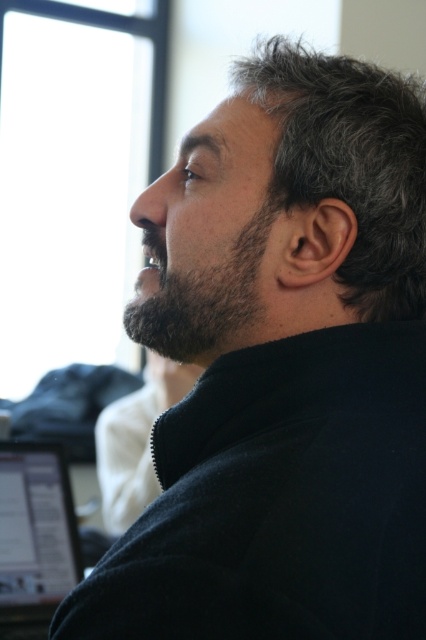
Question: Which object is farther from the camera taking this photo?

Choices:
 (A) black glossy laptop at lower left
 (B) dark brown fuzzy beard at center

Answer: (A)

Question: Is black glossy laptop at lower left bigger than dark brown fuzzy beard at center?

Choices:
 (A) no
 (B) yes

Answer: (B)

Question: Can you confirm if black glossy laptop at lower left is bigger than dark brown fuzzy beard at center?

Choices:
 (A) yes
 (B) no

Answer: (A)

Question: Does black glossy laptop at lower left lie in front of dark brown fuzzy beard at center?

Choices:
 (A) no
 (B) yes

Answer: (A)